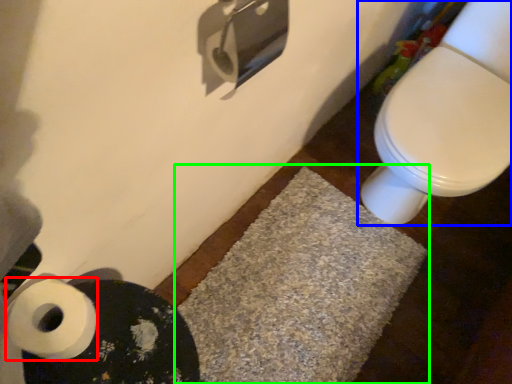
Question: Estimate the real-world distances between objects in this image. Which object is closer to toilet paper (highlighted by a red box), toilet (highlighted by a blue box) or bath mat (highlighted by a green box)?

Choices:
 (A) toilet
 (B) bath mat

Answer: (B)